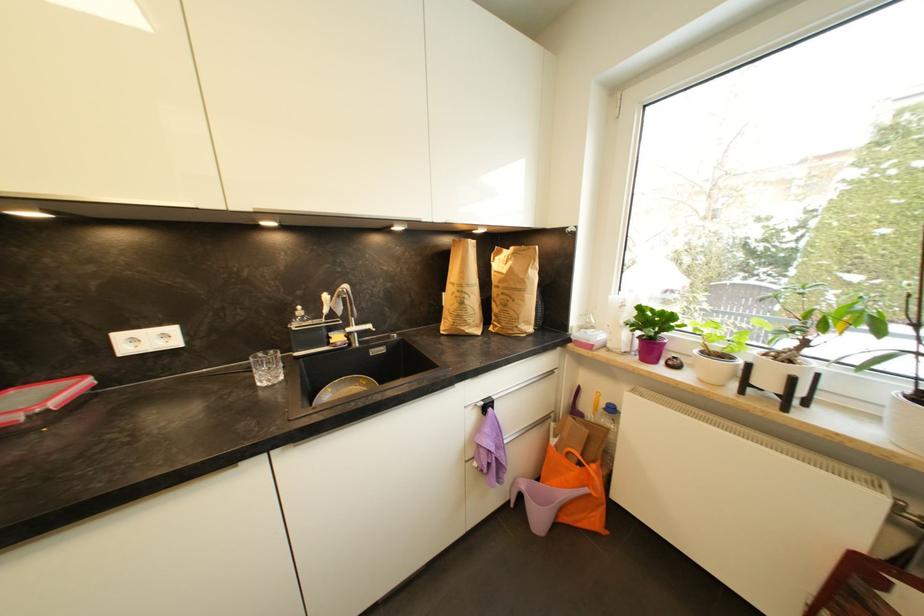
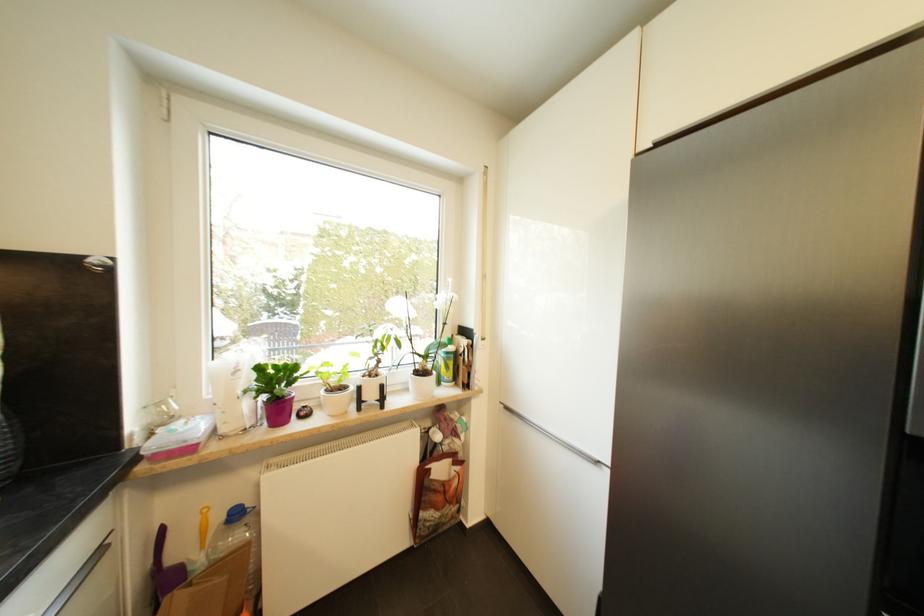
In the second image, find the point that corresponds to point (712, 355) in the first image.

(336, 392)